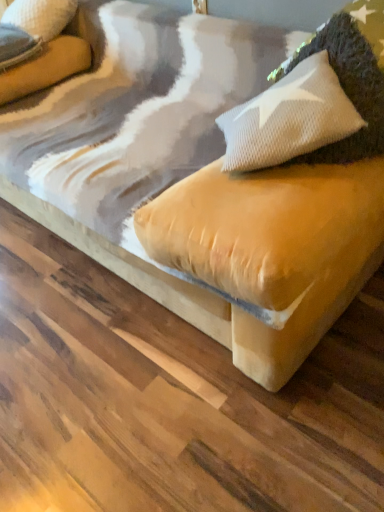
The width and height of the screenshot is (384, 512). Identify the location of white textured pillow at upper right, placed as the 1th pillow when sorted from bottom to top. (351, 76).

The width and height of the screenshot is (384, 512). What do you see at coordinates (351, 76) in the screenshot? I see `white textured pillow at upper right, the first pillow in the right-to-left sequence` at bounding box center [351, 76].

In order to face white textured pillow at upper right, placed as the 1th pillow when sorted from bottom to top, should I rotate leftwards or rightwards?

Rotate right and turn 20.035 degrees.

The width and height of the screenshot is (384, 512). What do you see at coordinates (40, 16) in the screenshot?
I see `velvet beige pillow at upper left, marked as the second pillow in a bottom-to-top arrangement` at bounding box center [40, 16].

At what (x,y) coordinates should I click in order to perform the action: click on velvet beige pillow at upper left, which is counted as the second pillow, starting from the right. Please return your answer as a coordinate pair (x, y). Looking at the image, I should click on (40, 16).

In order to click on white textured pillow at upper right, which ranks as the second pillow in left-to-right order in this screenshot , I will do `click(351, 76)`.

Which object is positioned more to the right, white textured pillow at upper right, the first pillow in the right-to-left sequence, or velvet beige pillow at upper left, positioned as the first pillow in left-to-right order?

From the viewer's perspective, white textured pillow at upper right, the first pillow in the right-to-left sequence, appears more on the right side.

In the image, is white textured pillow at upper right, placed as the 1th pillow when sorted from bottom to top, positioned in front of or behind velvet beige pillow at upper left, which is counted as the 1th pillow, starting from the top?

white textured pillow at upper right, placed as the 1th pillow when sorted from bottom to top, is positioned closer to the viewer than velvet beige pillow at upper left, which is counted as the 1th pillow, starting from the top.

Which is nearer, (372, 42) or (45, 22)?

Point (372, 42)

From the image's perspective, is white textured pillow at upper right, which is the second pillow from back to front, below velvet beige pillow at upper left, marked as the second pillow in a bottom-to-top arrangement?

Yes, from the image's perspective, white textured pillow at upper right, which is the second pillow from back to front, is beneath velvet beige pillow at upper left, marked as the second pillow in a bottom-to-top arrangement.

From a real-world perspective, who is located higher, white textured pillow at upper right, placed as the 1th pillow when sorted from bottom to top, or velvet beige pillow at upper left, marked as the second pillow in a bottom-to-top arrangement?

white textured pillow at upper right, placed as the 1th pillow when sorted from bottom to top.

Does white textured pillow at upper right, which is the second pillow from back to front, have a greater width compared to velvet beige pillow at upper left, positioned as the first pillow in left-to-right order?

Correct, the width of white textured pillow at upper right, which is the second pillow from back to front, exceeds that of velvet beige pillow at upper left, positioned as the first pillow in left-to-right order.

Who is shorter, white textured pillow at upper right, which is the second pillow from back to front, or velvet beige pillow at upper left, marked as the 1th pillow in a back-to-front arrangement?

velvet beige pillow at upper left, marked as the 1th pillow in a back-to-front arrangement.

Does white textured pillow at upper right, which is the second pillow from back to front, have a smaller size compared to velvet beige pillow at upper left, marked as the 1th pillow in a back-to-front arrangement?

Incorrect, white textured pillow at upper right, which is the second pillow from back to front, is not smaller in size than velvet beige pillow at upper left, marked as the 1th pillow in a back-to-front arrangement.

Could velvet beige pillow at upper left, marked as the second pillow in a bottom-to-top arrangement, be considered to be inside white textured pillow at upper right, the first pillow in the right-to-left sequence?

No, velvet beige pillow at upper left, marked as the second pillow in a bottom-to-top arrangement, is not a part of white textured pillow at upper right, the first pillow in the right-to-left sequence.

Are white textured pillow at upper right, the first pillow in the right-to-left sequence, and velvet beige pillow at upper left, positioned as the first pillow in left-to-right order, making contact?

No, white textured pillow at upper right, the first pillow in the right-to-left sequence, is not touching velvet beige pillow at upper left, positioned as the first pillow in left-to-right order.

Is white textured pillow at upper right, which is the second pillow from back to front, oriented away from velvet beige pillow at upper left, marked as the 1th pillow in a back-to-front arrangement?

No.

How many degrees apart are the facing directions of white textured pillow at upper right, the 2th pillow when ordered from top to bottom, and velvet beige pillow at upper left, positioned as the first pillow in left-to-right order?

They differ by 1.07 degrees in their facing directions.

Measure the distance between white textured pillow at upper right, the 2th pillow when ordered from top to bottom, and velvet beige pillow at upper left, marked as the second pillow in a bottom-to-top arrangement.

They are 1.38 meters apart.

This screenshot has width=384, height=512. Find the location of `pillow in front of the velvet beige pillow at upper left, acting as the second pillow starting from the front`. pillow in front of the velvet beige pillow at upper left, acting as the second pillow starting from the front is located at coordinates (351, 76).

Visually, is velvet beige pillow at upper left, which is counted as the 1th pillow, starting from the top, positioned to the left or to the right of white textured pillow at upper right, which ranks as the second pillow in left-to-right order?

Based on their positions, velvet beige pillow at upper left, which is counted as the 1th pillow, starting from the top, is located to the left of white textured pillow at upper right, which ranks as the second pillow in left-to-right order.

Which object is more forward, velvet beige pillow at upper left, marked as the second pillow in a bottom-to-top arrangement, or white textured pillow at upper right, acting as the first pillow starting from the front?

white textured pillow at upper right, acting as the first pillow starting from the front.

Considering the points (12, 20) and (356, 108), which point is in front, point (12, 20) or point (356, 108)?

The point (356, 108) is closer to the camera.

From the image's perspective, which one is positioned higher, velvet beige pillow at upper left, acting as the second pillow starting from the front, or white textured pillow at upper right, the 2th pillow when ordered from top to bottom?

velvet beige pillow at upper left, acting as the second pillow starting from the front, is shown above in the image.

From a real-world perspective, is velvet beige pillow at upper left, acting as the second pillow starting from the front, positioned above or below white textured pillow at upper right, which is the second pillow from back to front?

From a real-world perspective, velvet beige pillow at upper left, acting as the second pillow starting from the front, is physically below white textured pillow at upper right, which is the second pillow from back to front.

Considering the sizes of objects velvet beige pillow at upper left, acting as the second pillow starting from the front, and white textured pillow at upper right, which is the second pillow from back to front, in the image provided, who is thinner, velvet beige pillow at upper left, acting as the second pillow starting from the front, or white textured pillow at upper right, which is the second pillow from back to front,?

velvet beige pillow at upper left, acting as the second pillow starting from the front, is thinner.

Is velvet beige pillow at upper left, marked as the second pillow in a bottom-to-top arrangement, shorter than white textured pillow at upper right, which is the second pillow from back to front?

Yes.

Based on their sizes in the image, would you say velvet beige pillow at upper left, marked as the second pillow in a bottom-to-top arrangement, is bigger or smaller than white textured pillow at upper right, acting as the first pillow starting from the front?

velvet beige pillow at upper left, marked as the second pillow in a bottom-to-top arrangement, is smaller than white textured pillow at upper right, acting as the first pillow starting from the front.

Is velvet beige pillow at upper left, positioned as the first pillow in left-to-right order, located outside white textured pillow at upper right, which ranks as the second pillow in left-to-right order?

Yes, velvet beige pillow at upper left, positioned as the first pillow in left-to-right order, is not within white textured pillow at upper right, which ranks as the second pillow in left-to-right order.

Are velvet beige pillow at upper left, positioned as the first pillow in left-to-right order, and white textured pillow at upper right, acting as the first pillow starting from the front, making contact?

No, velvet beige pillow at upper left, positioned as the first pillow in left-to-right order, is not touching white textured pillow at upper right, acting as the first pillow starting from the front.

Is velvet beige pillow at upper left, which is counted as the 1th pillow, starting from the top, aimed at white textured pillow at upper right, the 2th pillow when ordered from top to bottom?

No, velvet beige pillow at upper left, which is counted as the 1th pillow, starting from the top, does not turn towards white textured pillow at upper right, the 2th pillow when ordered from top to bottom.

How different are the orientations of velvet beige pillow at upper left, which is counted as the 1th pillow, starting from the top, and white textured pillow at upper right, placed as the 1th pillow when sorted from bottom to top, in degrees?

velvet beige pillow at upper left, which is counted as the 1th pillow, starting from the top, and white textured pillow at upper right, placed as the 1th pillow when sorted from bottom to top, are facing 1.07 degrees away from each other.

How much distance is there between velvet beige pillow at upper left, which is counted as the second pillow, starting from the right, and white textured pillow at upper right, acting as the first pillow starting from the front?

The distance of velvet beige pillow at upper left, which is counted as the second pillow, starting from the right, from white textured pillow at upper right, acting as the first pillow starting from the front, is 1.38 meters.

Locate an element on the screen. The image size is (384, 512). pillow below the white textured pillow at upper right, which is the second pillow from back to front (from a real-world perspective) is located at coordinates pos(40,16).

Locate an element on the screen. This screenshot has width=384, height=512. pillow that appears on the left of white textured pillow at upper right, placed as the 1th pillow when sorted from bottom to top is located at coordinates (40, 16).

Find the location of a particular element. pillow below the velvet beige pillow at upper left, which is counted as the 1th pillow, starting from the top (from the image's perspective) is located at coordinates (351, 76).